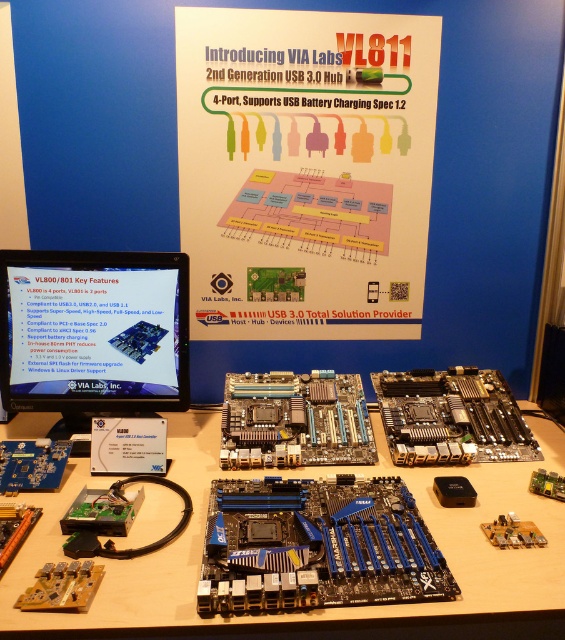
You are an engineer inspecting the display setup at the tech event. You notice a point marked at coordinates [315,609] on the image. What object is located at this point?

The blue printed circuit board at center is located at point [315,609].

You are a technician standing at the front of the display table. You need to locate the blue metallic motherboard at center for a demonstration. According to the coordinates provided, where exactly should you look on the table?

The blue metallic motherboard at center is located at point (316, 545) on the table.